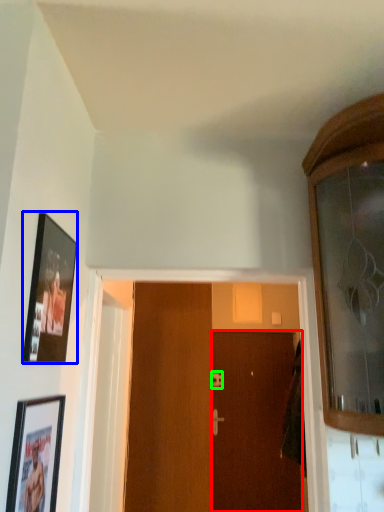
Question: Based on their relative distances, which object is nearer to door (highlighted by a red box)? Choose from picture frame (highlighted by a blue box) and door handle (highlighted by a green box).

Choices:
 (A) picture frame
 (B) door handle

Answer: (B)